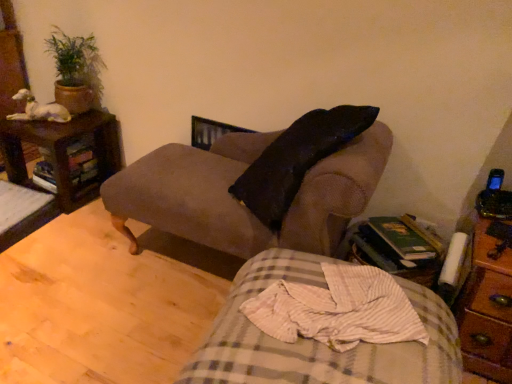
Find the location of a particular element. The image size is (512, 384). free space above plaid fabric bed at lower center (from a real-world perspective) is located at coordinates (330, 317).